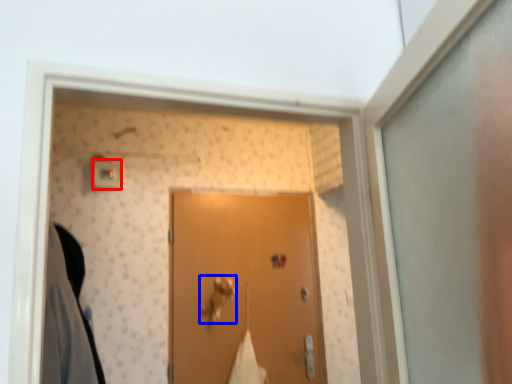
Question: Which point is closer to the camera, light switch (highlighted by a red box) or door handle (highlighted by a blue box)?

Choices:
 (A) light switch
 (B) door handle

Answer: (A)